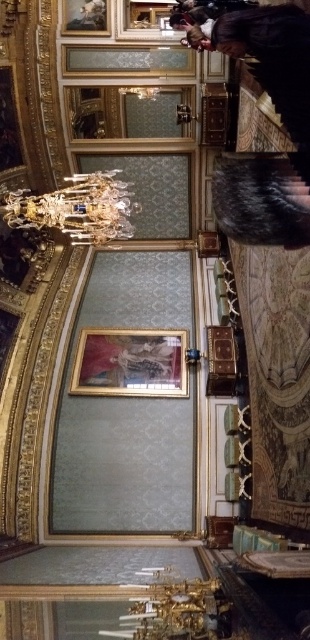
Which is below, crystal glass chandelier at upper center or gold/gilded picture frame at upper center?

crystal glass chandelier at upper center

Image resolution: width=310 pixels, height=640 pixels. What do you see at coordinates (76, 209) in the screenshot?
I see `crystal glass chandelier at upper center` at bounding box center [76, 209].

Locate an element on the screen. The width and height of the screenshot is (310, 640). crystal glass chandelier at upper center is located at coordinates (76, 209).

Who is higher up, gold-framed painting at center or crystal glass chandelier at upper center?

Positioned higher is crystal glass chandelier at upper center.

Who is lower down, gold-framed painting at center or crystal glass chandelier at upper center?

gold-framed painting at center is below.

Which is behind, point (96, 387) or point (20, 193)?

Positioned behind is point (96, 387).

You are a GUI agent. You are given a task and a screenshot of the screen. Output one action in this format:
    pyautogui.click(x=<x>, y=<y>)
    Task: Click on the gold-framed painting at center
    This screenshot has height=640, width=310.
    Given the screenshot: What is the action you would take?
    pyautogui.click(x=131, y=364)

Is the position of gold-framed painting at center less distant than that of gold/gilded picture frame at upper center?

Yes, gold-framed painting at center is in front of gold/gilded picture frame at upper center.

Which is in front, point (173, 388) or point (85, 19)?

Point (173, 388) is more forward.

Where is `gold-framed painting at center`? The image size is (310, 640). gold-framed painting at center is located at coordinates (131, 364).